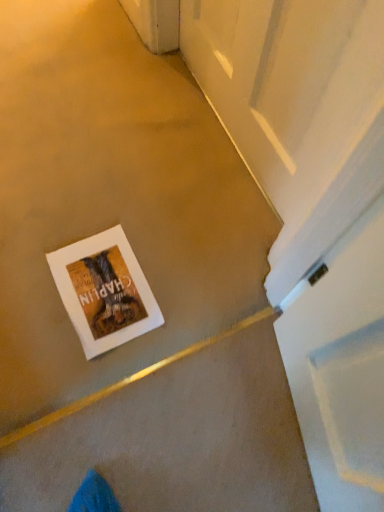
I want to click on blank space situated above white paper postcard at center (from a real-world perspective), so click(96, 283).